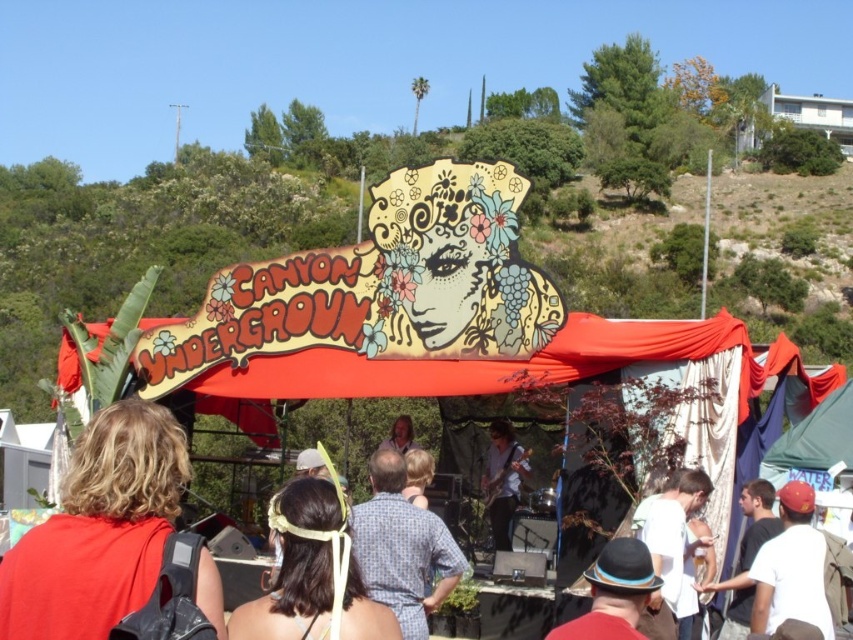
Question: Which of the following is the farthest from the observer?

Choices:
 (A) (792, 580)
 (B) (393, 424)

Answer: (B)

Question: Is matte yellow headband at center below matte black guitar at center?

Choices:
 (A) no
 (B) yes

Answer: (B)

Question: Is white cotton shirt at center thinner than white t-shirt at center?

Choices:
 (A) yes
 (B) no

Answer: (A)

Question: Among these points, which one is farthest from the camera?

Choices:
 (A) (119, 586)
 (B) (665, 557)

Answer: (B)

Question: Which of the following is the closest to the observer?

Choices:
 (A) matte yellow headband at center
 (B) white cotton shirt at lower right
 (C) matte black guitar at center

Answer: (A)

Question: In this image, where is blonde hair at center located relative to black felt hat at center?

Choices:
 (A) above
 (B) below

Answer: (A)